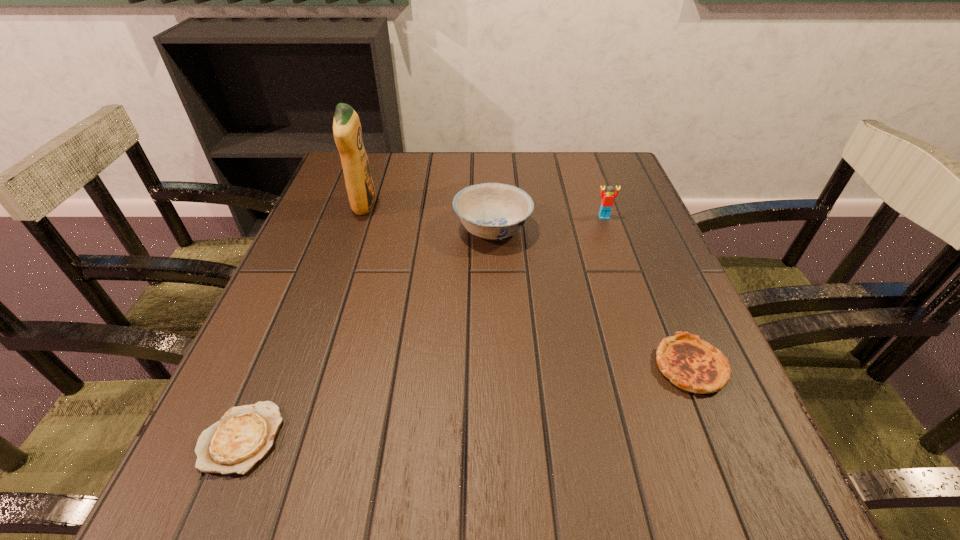
Where is `free region at the far edge`? This screenshot has height=540, width=960. free region at the far edge is located at coordinates coord(396,184).

In the image, there is a desktop. At what (x,y) coordinates should I click in order to perform the action: click on vacant area at the near edge. Please return your answer as a coordinate pair (x, y). Looking at the image, I should click on pyautogui.click(x=401, y=496).

In the image, there is a desktop. At what (x,y) coordinates should I click in order to perform the action: click on vacant region at the left edge. Please return your answer as a coordinate pair (x, y). Looking at the image, I should click on (327, 244).

Locate an element on the screen. The image size is (960, 540). vacant space at the right edge of the desktop is located at coordinates (649, 396).

At what (x,y) coordinates should I click in order to perform the action: click on free space at the far left corner. Please return your answer as a coordinate pair (x, y). The height and width of the screenshot is (540, 960). Looking at the image, I should click on (328, 194).

Locate an element on the screen. free space at the far right corner is located at coordinates [x=614, y=154].

At what (x,y) coordinates should I click in order to perform the action: click on free region at the near right corner. Please return your answer as a coordinate pair (x, y). Image resolution: width=960 pixels, height=540 pixels. Looking at the image, I should click on (729, 520).

Locate an element on the screen. Image resolution: width=960 pixels, height=540 pixels. free spot between the Lego and the shorter quiche is located at coordinates (422, 327).

You are a GUI agent. You are given a task and a screenshot of the screen. Output one action in this format:
    pyautogui.click(x=<x>, y=<y>)
    Task: Click on the vacant point located between the third object from left to right and the taller quiche
    
    Given the screenshot: What is the action you would take?
    pyautogui.click(x=591, y=298)

Locate an element on the screen. This screenshot has height=540, width=960. free space that is in between the farther quiche and the bowl is located at coordinates (591, 298).